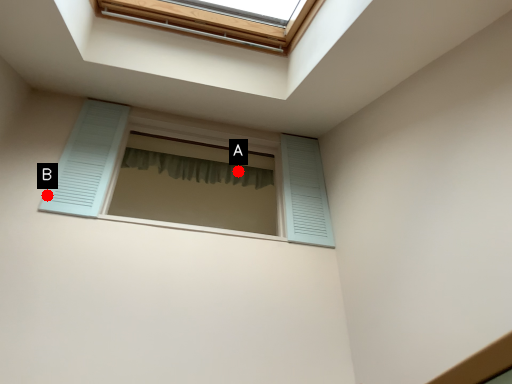
Question: Two points are circled on the image, labeled by A and B beside each circle. Which point is further to the camera?

Choices:
 (A) A is further
 (B) B is further

Answer: (A)